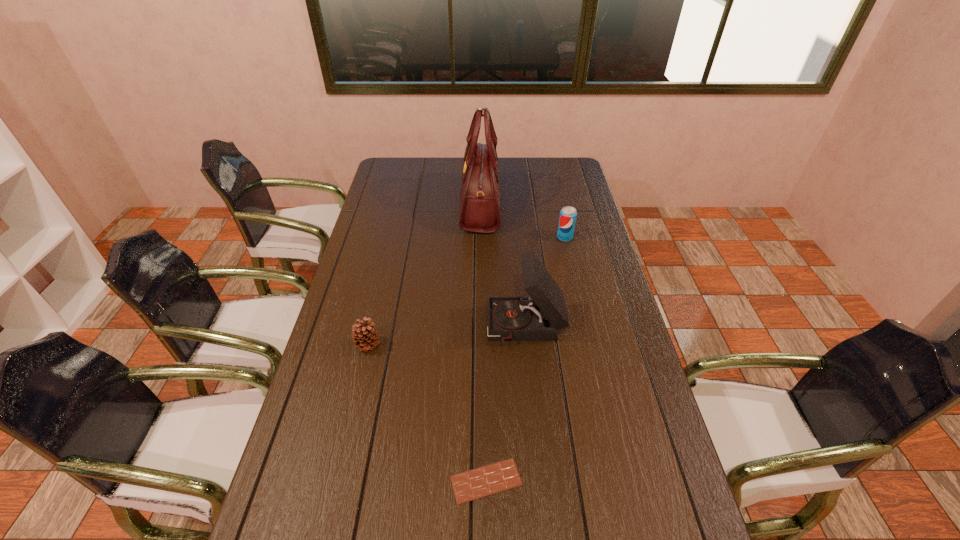
In order to click on free space at the right edge of the desktop in this screenshot , I will do `click(548, 186)`.

This screenshot has height=540, width=960. In the image, there is a desktop. In order to click on vacant region at the far right corner in this screenshot , I will do [x=548, y=173].

Locate an element on the screen. The height and width of the screenshot is (540, 960). unoccupied position between the pinecone and the second tallest object is located at coordinates pos(446,336).

The height and width of the screenshot is (540, 960). Identify the location of free area in between the pinecone and the soda can. (467, 291).

At what (x,y) coordinates should I click in order to perform the action: click on vacant area between the rightmost object and the leftmost object. Please return your answer as a coordinate pair (x, y). The height and width of the screenshot is (540, 960). Looking at the image, I should click on (467, 291).

At what (x,y) coordinates should I click in order to perform the action: click on free space that is in between the soda can and the pinecone. Please return your answer as a coordinate pair (x, y). The height and width of the screenshot is (540, 960). Looking at the image, I should click on (467, 291).

In order to click on vacant area between the handbag and the leftmost object in this screenshot , I will do `click(424, 274)`.

Where is `vacant area that lies between the pinecone and the handbag`? vacant area that lies between the pinecone and the handbag is located at coordinates (424, 274).

Locate an element on the screen. This screenshot has height=540, width=960. free space that is in between the shortest object and the handbag is located at coordinates (484, 342).

This screenshot has width=960, height=540. Identify the location of vacant area that lies between the tallest object and the pinecone. (424, 274).